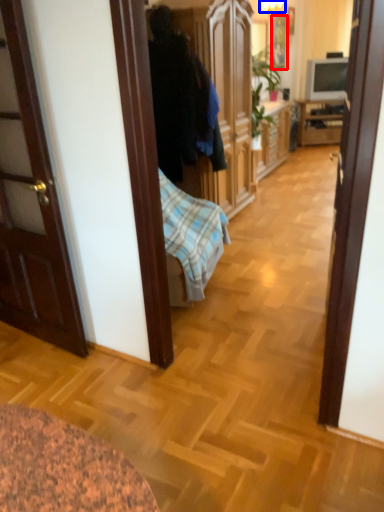
Question: Which object appears farthest to the camera in this image, picture frame (highlighted by a red box) or lamp (highlighted by a blue box)?

Choices:
 (A) picture frame
 (B) lamp

Answer: (A)